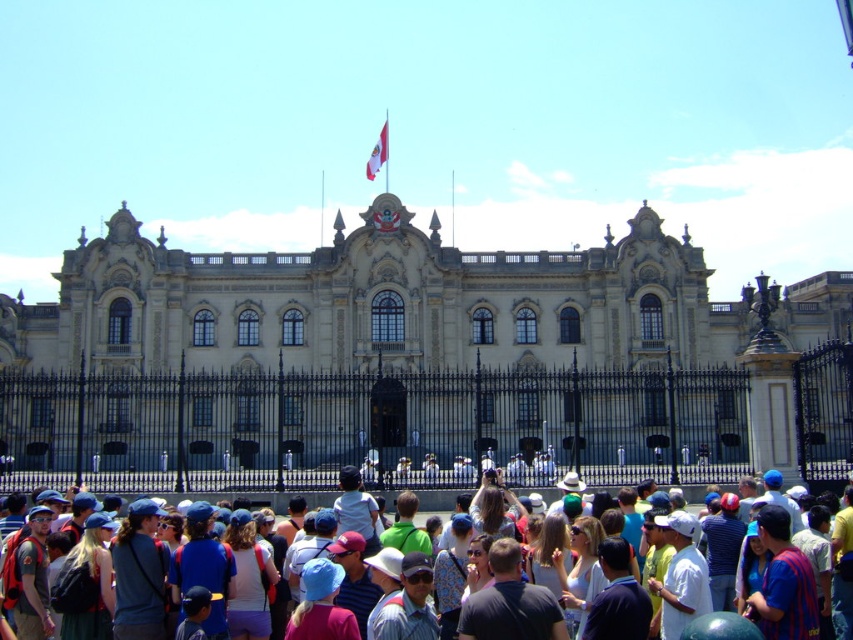
The height and width of the screenshot is (640, 853). What are the coordinates of `denim shorts at lower center` in the screenshot? It's located at (248, 579).

Find the location of `denim shorts at lower center`. denim shorts at lower center is located at coordinates (248, 579).

Can you confirm if beige stone palace at center is positioned to the right of denim shorts at lower center?

Indeed, beige stone palace at center is positioned on the right side of denim shorts at lower center.

Is point (515, 369) farther from viewer compared to point (233, 636)?

Yes, point (515, 369) is farther from viewer.

Which is in front, point (320, 266) or point (247, 595)?

Point (247, 595) is more forward.

Where is `beige stone palace at center`? This screenshot has height=640, width=853. beige stone palace at center is located at coordinates (386, 340).

In order to click on beige stone palace at center in this screenshot , I will do `click(386, 340)`.

Is beige stone palace at center to the right of multicolored casual attire at center from the viewer's perspective?

Yes, beige stone palace at center is to the right of multicolored casual attire at center.

Is point (381, 451) closer to viewer compared to point (173, 497)?

Yes.

Where is `beige stone palace at center`? The width and height of the screenshot is (853, 640). beige stone palace at center is located at coordinates (386, 340).